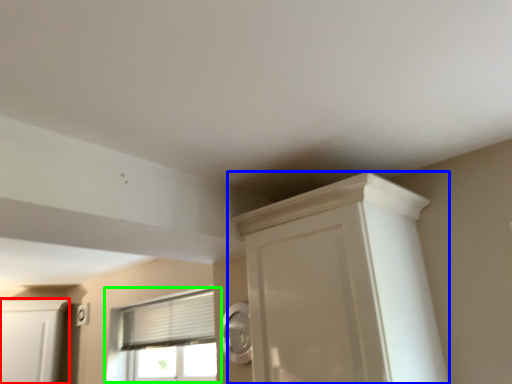
Question: Estimate the real-world distances between objects in this image. Which object is closer to cabinetry (highlighted by a red box), cupboard (highlighted by a blue box) or window (highlighted by a green box)?

Choices:
 (A) cupboard
 (B) window

Answer: (B)